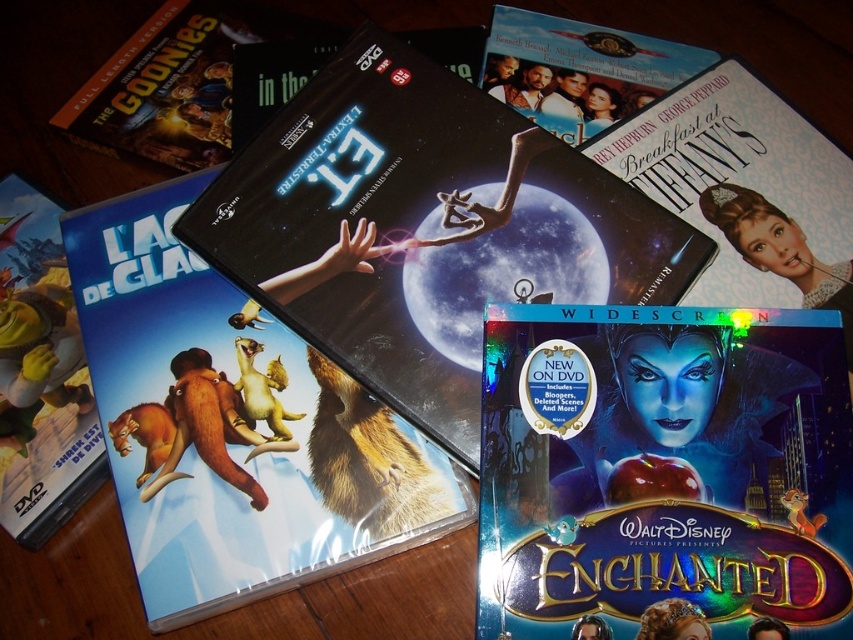
You are organizing DVDs on a shelf and notice the black glossy dvd case at center. Where exactly is it placed in relation to the other DVDs?

The black glossy dvd case at center is located at point coordinates 0.667 along the horizontal axis and 0.274 along the vertical axis relative to the other DVDs.

You are standing at the edge of the wooden surface where the DVDs are placed. You want to pick up the DVD located at point (466, 150) and the one at point (56, 248). Which DVD will you need to reach over first?

Since point (466, 150) is in front of point (56, 248), you will need to reach over the DVD at point (466, 150) first to access the one behind it at point (56, 248).

You have a storage box that can only accommodate items narrower than the matte black book at upper center. Can the blue glossy dvd case at lower left fit into the box?

The blue glossy dvd case at lower left has a lesser width compared to the matte black book at upper center, so it can fit into the storage box.